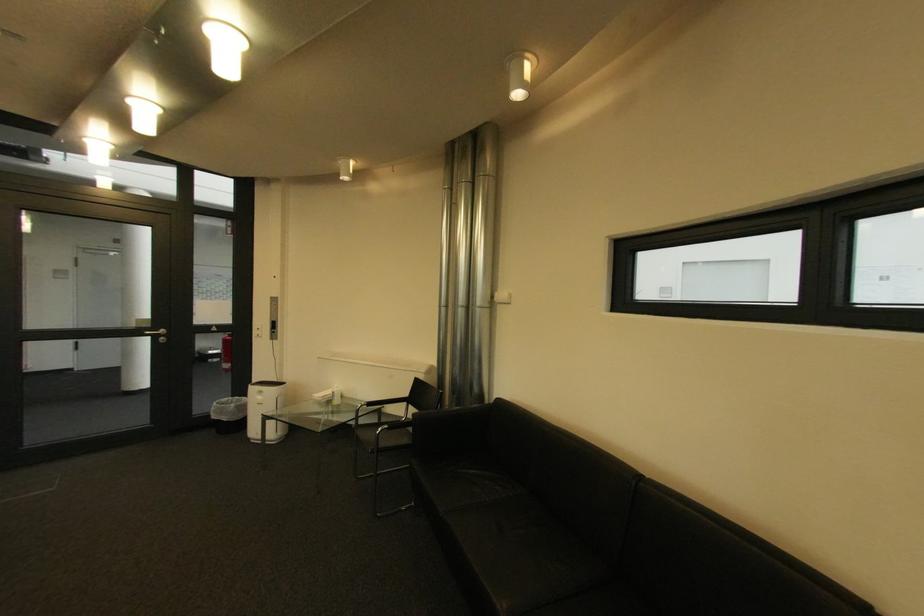
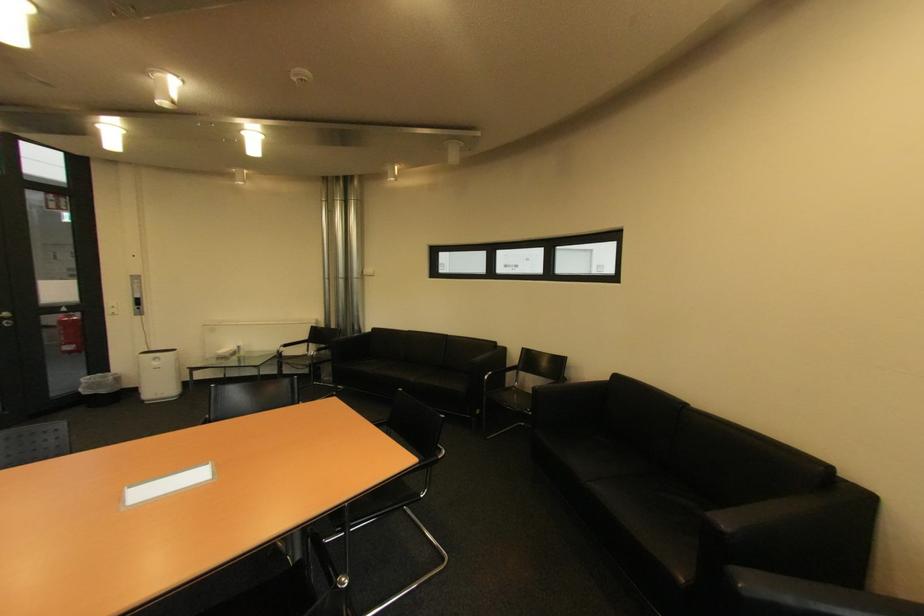
Locate, in the second image, the point that corresponds to (x=223, y=418) in the first image.

(94, 394)